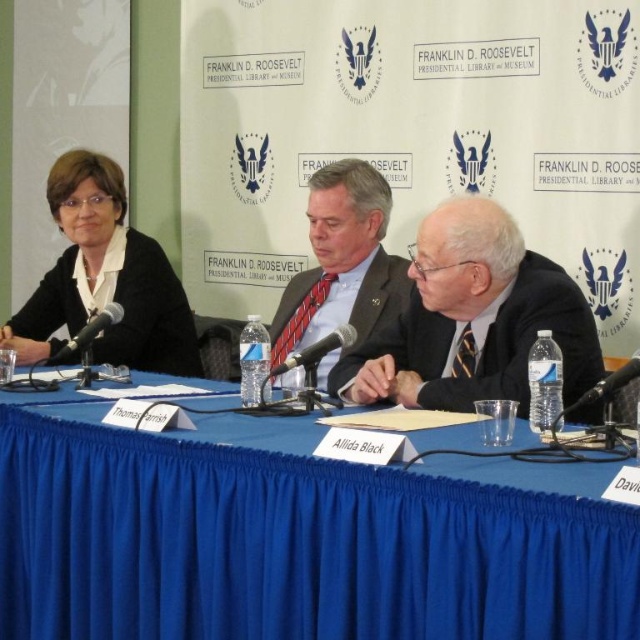
Question: Considering the relative positions of blue fabric table at center and matte black jacket at left in the image provided, where is blue fabric table at center located with respect to matte black jacket at left?

Choices:
 (A) right
 (B) left

Answer: (A)

Question: Considering the real-world distances, which object is closest to the matte black jacket at left?

Choices:
 (A) matte gray suit at center
 (B) blue fabric table at center

Answer: (A)

Question: Is blue fabric table at center smaller than matte black jacket at left?

Choices:
 (A) no
 (B) yes

Answer: (A)

Question: Which point appears farthest from the camera in this image?

Choices:
 (A) (250, 419)
 (B) (308, 221)
 (C) (566, 352)
 (D) (152, 358)

Answer: (B)

Question: Does matte black jacket at left appear on the right side of matte gray suit at center?

Choices:
 (A) yes
 (B) no

Answer: (B)

Question: Based on their relative distances, which object is farther from the blue fabric table at center?

Choices:
 (A) matte black jacket at left
 (B) dark suit at center

Answer: (A)